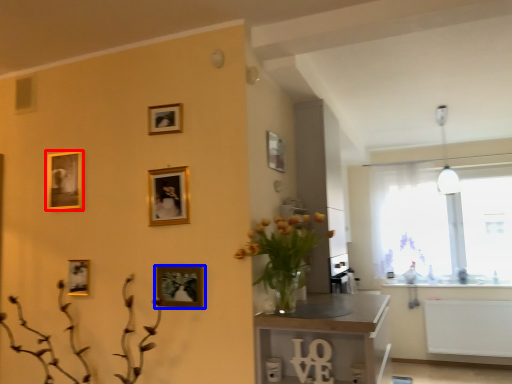
Question: Which point is further to the camera, picture frame (highlighted by a red box) or picture frame (highlighted by a blue box)?

Choices:
 (A) picture frame
 (B) picture frame

Answer: (A)